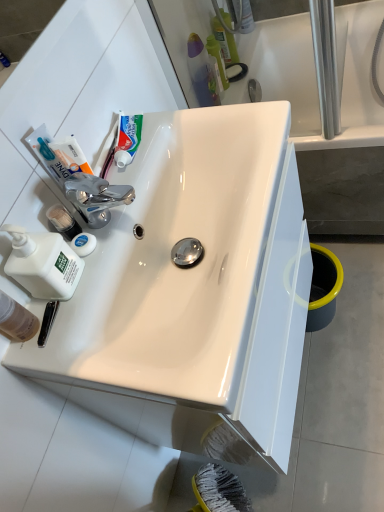
The image size is (384, 512). In order to click on free space above white glossy sink at center (from a real-world perspective) in this screenshot , I will do `click(127, 214)`.